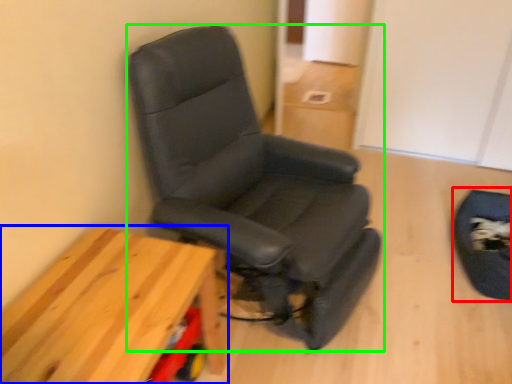
Question: Which is farther away from swivel chair (highlighted by a red box)? table (highlighted by a blue box) or chair (highlighted by a green box)?

Choices:
 (A) table
 (B) chair

Answer: (A)